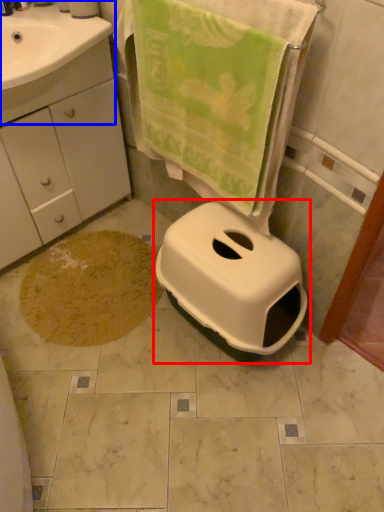
Question: Among these objects, which one is farthest to the camera, toilet (highlighted by a red box) or sink (highlighted by a blue box)?

Choices:
 (A) toilet
 (B) sink

Answer: (B)